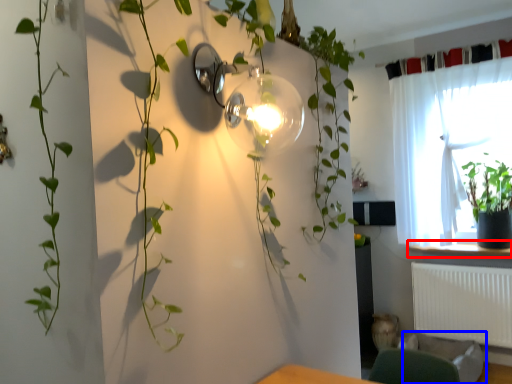
Question: Which point is further to the camera, window sill (highlighted by a red box) or swivel chair (highlighted by a blue box)?

Choices:
 (A) window sill
 (B) swivel chair

Answer: (A)